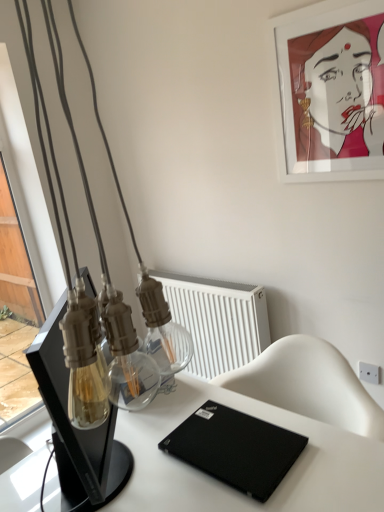
Question: Considering the positions of white plastic electric outlet at upper right and black matte laptop at lower right in the image, is white plastic electric outlet at upper right taller or shorter than black matte laptop at lower right?

Choices:
 (A) short
 (B) tall

Answer: (B)

Question: In the image, is white plastic electric outlet at upper right on the left side or the right side of black matte laptop at lower right?

Choices:
 (A) right
 (B) left

Answer: (A)

Question: Which is farther from the black matte laptop at center?

Choices:
 (A) white plastic electric outlet at upper right
 (B) white matte picture frame at upper right
 (C) white plastic radiator at center
 (D) clear glass bottle at center
 (E) black matte laptop at lower right

Answer: (B)

Question: Which is farther from the black matte laptop at center?

Choices:
 (A) white plastic radiator at center
 (B) black matte laptop at lower right
 (C) clear glass bottle at center
 (D) white plastic electric outlet at upper right
 (E) white matte picture frame at upper right

Answer: (E)